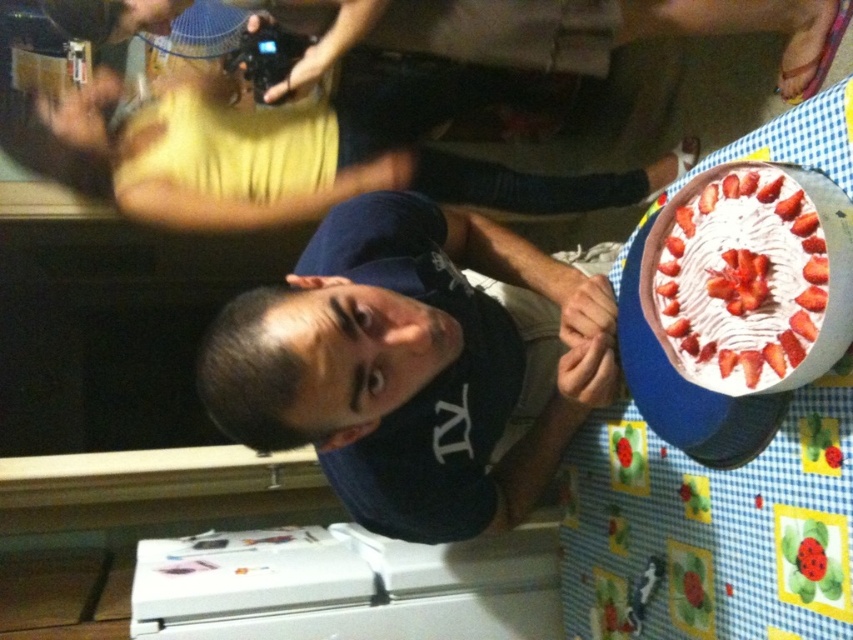
You are a GUI agent. You are given a task and a screenshot of the screen. Output one action in this format:
    pyautogui.click(x=<x>, y=<y>)
    Task: Click on the dark blue t-shirt at center
    
    Given the screenshot: What is the action you would take?
    pyautogui.click(x=416, y=365)

The image size is (853, 640). What do you see at coordinates (416, 365) in the screenshot?
I see `dark blue t-shirt at center` at bounding box center [416, 365].

Is point (364, 330) in front of point (738, 220)?

That is False.

Find the location of a particular element. dark blue t-shirt at center is located at coordinates (416, 365).